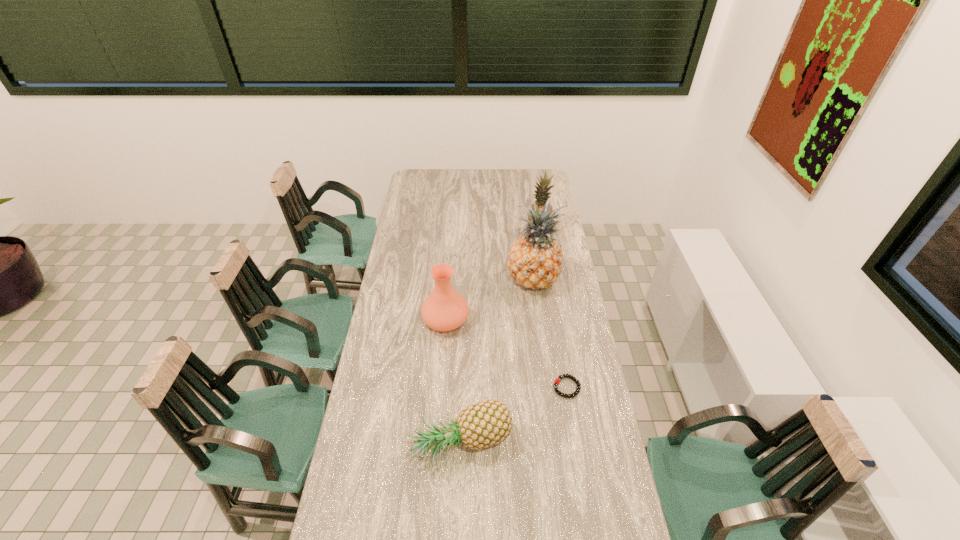
Locate an element on the screen. blank region between the nearest pineapple and the second nearest pineapple is located at coordinates (497, 364).

In order to click on free spot between the bracelet and the farthest pineapple in this screenshot , I will do `click(553, 310)`.

Locate an element on the screen. The width and height of the screenshot is (960, 540). free spot between the second farthest object and the bracelet is located at coordinates (550, 334).

Locate an element on the screen. This screenshot has width=960, height=540. free space between the farthest pineapple and the vase is located at coordinates (492, 276).

Where is `empty location between the shortest object and the vase`? This screenshot has width=960, height=540. empty location between the shortest object and the vase is located at coordinates point(506,354).

Image resolution: width=960 pixels, height=540 pixels. I want to click on empty space that is in between the third shortest object and the shortest object, so click(x=506, y=354).

At what (x,y) coordinates should I click in order to perform the action: click on free spot between the second nearest pineapple and the vase. Please return your answer as a coordinate pair (x, y). The height and width of the screenshot is (540, 960). Looking at the image, I should click on (490, 300).

You are a GUI agent. You are given a task and a screenshot of the screen. Output one action in this format:
    pyautogui.click(x=<x>, y=<y>)
    Task: Click on the vacant space that's between the second tallest object and the vase
    
    Given the screenshot: What is the action you would take?
    pyautogui.click(x=492, y=276)

This screenshot has width=960, height=540. In order to click on free space that is in between the nearest pineapple and the second nearest object in this screenshot , I will do `click(514, 417)`.

Find the location of a particular element. The height and width of the screenshot is (540, 960). object that is the fourth nearest to the leftmost pineapple is located at coordinates (541, 194).